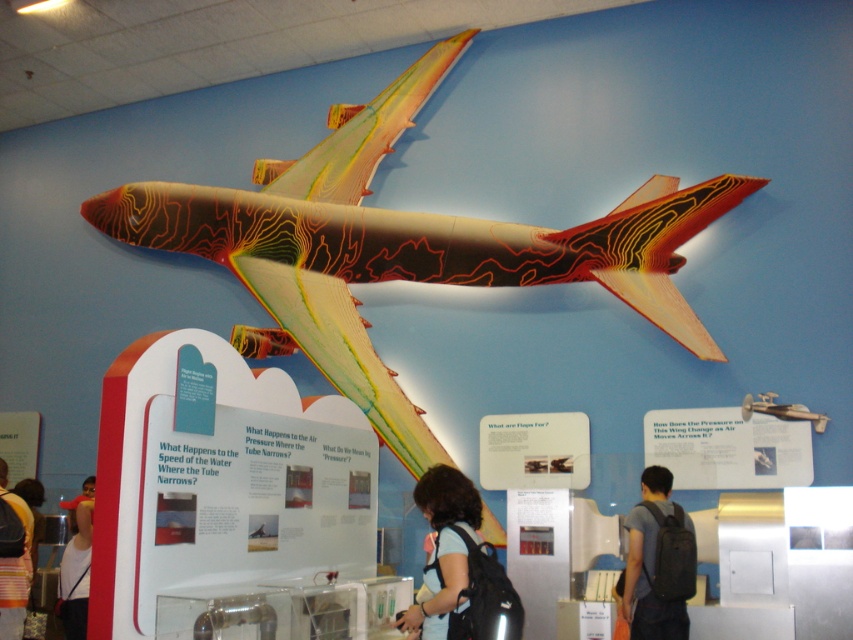
Question: Is black backpack at lower right behind striped backpack at lower left?

Choices:
 (A) no
 (B) yes

Answer: (A)

Question: Which object is the farthest from the dark brown hair at center?

Choices:
 (A) black backpack at lower right
 (B) striped backpack at lower left

Answer: (B)

Question: Which point is farther to the camera?

Choices:
 (A) (x=444, y=595)
 (B) (x=685, y=572)

Answer: (B)

Question: Is dark brown hair at center above white fabric shirt at lower left?

Choices:
 (A) yes
 (B) no

Answer: (A)

Question: Which object appears farthest from the camera in this image?

Choices:
 (A) striped backpack at lower left
 (B) multicolored painted airplane at upper center

Answer: (B)

Question: Can you confirm if white fabric shirt at lower left is smaller than striped backpack at lower left?

Choices:
 (A) no
 (B) yes

Answer: (B)